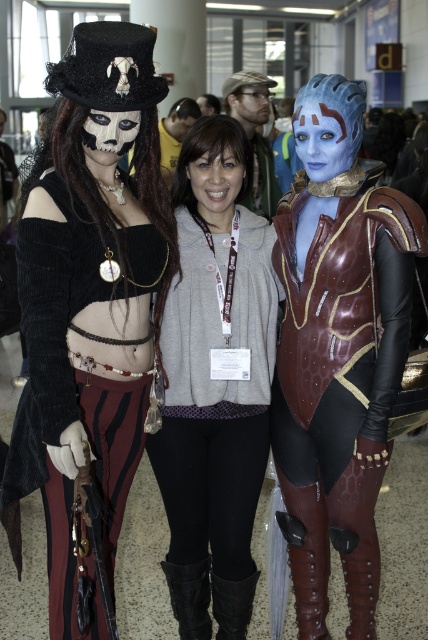
You are a photographer at the event and need to decide where to place a narrow spotlight. The spotlight is only 5 cm wide. You have to choose between placing it on the matte black hat at left or the gray fleece hoodie at center. Which object can the spotlight fit over without exceeding its width?

The matte black hat at left is thinner than the gray fleece hoodie at center, so the spotlight can fit over the matte black hat at left since it is narrower than 5 cm.

You are a photographer at the event and want to capture a photo where both the blue metallic armor at right and the gray fleece hoodie at center are clearly visible. Based on their positions, which one is closer to the camera?

The blue metallic armor at right is positioned over gray fleece hoodie at center, so it is closer to the camera.